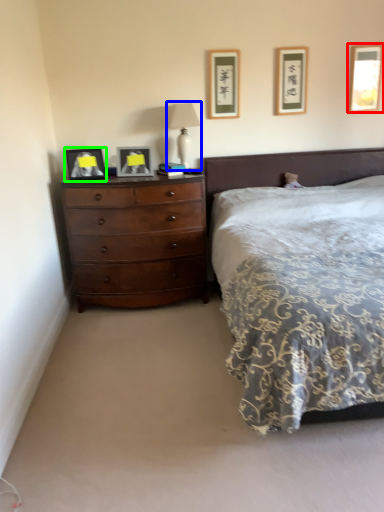
Question: Which object is the closest to the picture frame (highlighted by a red box)? Choose among these: bedside lamp (highlighted by a blue box) or picture frame (highlighted by a green box).

Choices:
 (A) bedside lamp
 (B) picture frame

Answer: (A)